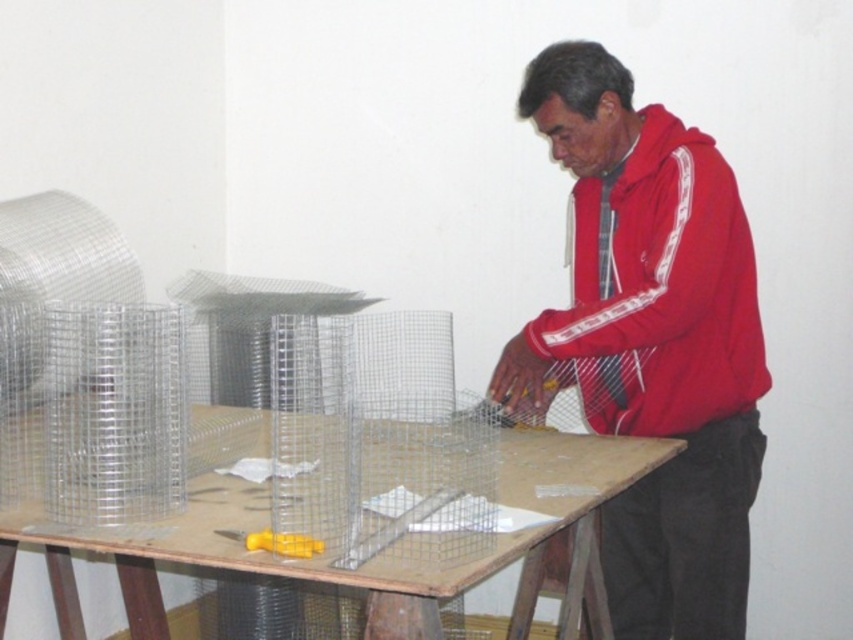
You are a delivery person who needs to place a small package on the wooden table at center. The package is 40 centimeters wide. Can you safely place it on the table without moving the red fleece jacket at center?

The red fleece jacket at center is 35.61 centimeters away from the wooden table at center. Since the package is 40 centimeters wide, placing it on the table would require at least 40 centimeters of space. The existing distance of 35.61 centimeters is insufficient, so you cannot safely place the package without moving the jacket.